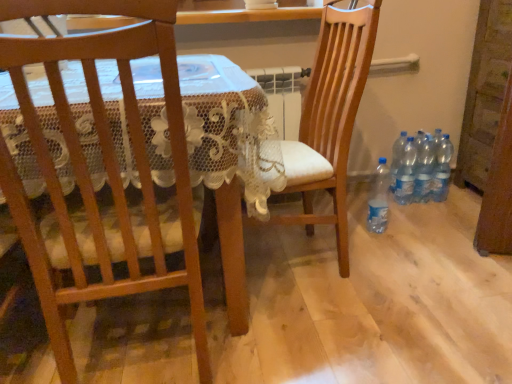
Question: Considering the relative sizes of wooden chair at left, the 2th chair in the right-to-left sequence, and wooden chair at center, which is counted as the 1th chair, starting from the right, in the image provided, is wooden chair at left, the 2th chair in the right-to-left sequence, bigger than wooden chair at center, which is counted as the 1th chair, starting from the right,?

Choices:
 (A) no
 (B) yes

Answer: (A)

Question: From the image's perspective, is wooden chair at left, which appears as the first chair when viewed from the left, under wooden chair at center, which is counted as the 1th chair, starting from the right?

Choices:
 (A) yes
 (B) no

Answer: (A)

Question: Is wooden chair at left, the 2th chair in the right-to-left sequence, touching wooden chair at center, which is counted as the 1th chair, starting from the right?

Choices:
 (A) no
 (B) yes

Answer: (A)

Question: Could you tell me if wooden chair at left, the 2th chair in the right-to-left sequence, is facing wooden chair at center, the 2th chair from the left?

Choices:
 (A) yes
 (B) no

Answer: (B)

Question: From a real-world perspective, is wooden chair at left, which appears as the first chair when viewed from the left, on wooden chair at center, the 2th chair from the left?

Choices:
 (A) yes
 (B) no

Answer: (A)

Question: From the image's perspective, is clear plastic bottles at lower right, the third bottle from the left, located above or below clear plastic bottles at lower right, the 5th bottle positioned from the left?

Choices:
 (A) below
 (B) above

Answer: (A)

Question: Based on their sizes in the image, would you say clear plastic bottles at lower right, the 3th bottle from the right, is bigger or smaller than clear plastic bottles at lower right, which is the 1th bottle from right to left?

Choices:
 (A) big
 (B) small

Answer: (B)

Question: In the image, is clear plastic bottles at lower right, the third bottle from the left, positioned in front of or behind clear plastic bottles at lower right, which is the 1th bottle from right to left?

Choices:
 (A) behind
 (B) front

Answer: (B)

Question: Considering the positions of point (399, 188) and point (443, 150), is point (399, 188) closer or farther from the camera than point (443, 150)?

Choices:
 (A) closer
 (B) farther

Answer: (A)

Question: Is point (423, 182) closer or farther from the camera than point (394, 175)?

Choices:
 (A) farther
 (B) closer

Answer: (B)

Question: Considering the relative positions of clear plastic bottles at lower right, which is counted as the 4th bottle, starting from the left, and clear plastic bottles at lower right, placed as the fourth bottle when sorted from right to left, in the image provided, is clear plastic bottles at lower right, which is counted as the 4th bottle, starting from the left, to the left or to the right of clear plastic bottles at lower right, placed as the fourth bottle when sorted from right to left,?

Choices:
 (A) left
 (B) right

Answer: (B)

Question: Is clear plastic bottles at lower right, which is counted as the 4th bottle, starting from the left, taller or shorter than clear plastic bottles at lower right, placed as the fourth bottle when sorted from right to left?

Choices:
 (A) tall
 (B) short

Answer: (A)

Question: Is clear plastic bottles at lower right, acting as the 2th bottle starting from the right, spatially inside clear plastic bottles at lower right, placed as the fourth bottle when sorted from right to left, or outside of it?

Choices:
 (A) outside
 (B) inside

Answer: (A)

Question: In the image, is clear plastic bottle at lower right, which appears as the 5th bottle when viewed from the right, on the left side or the right side of clear plastic bottles at lower right, the 3th bottle from the right?

Choices:
 (A) right
 (B) left

Answer: (B)

Question: In terms of size, does clear plastic bottle at lower right, which appears as the 1th bottle when viewed from the left, appear bigger or smaller than clear plastic bottles at lower right, the third bottle from the left?

Choices:
 (A) small
 (B) big

Answer: (B)